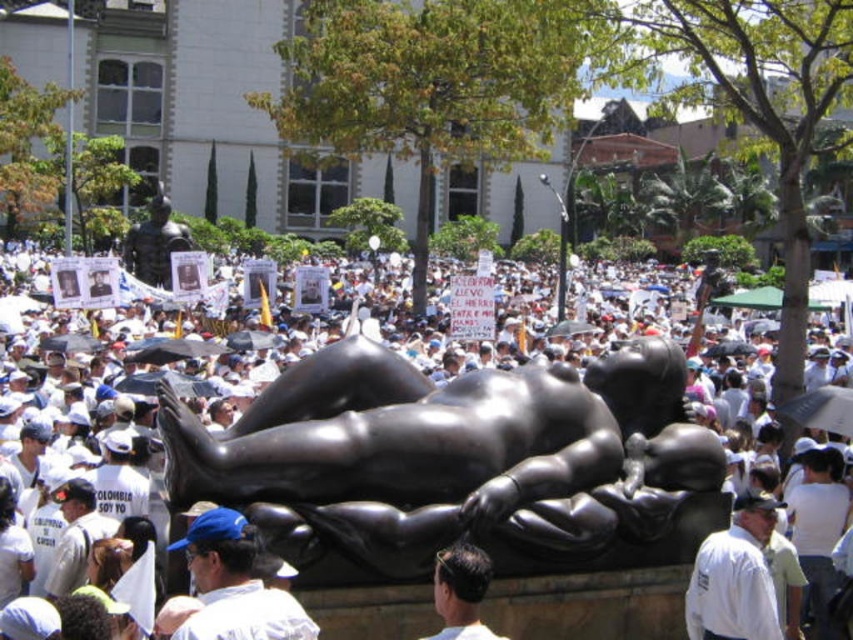
In the scene shown: You are a photographer trying to capture a clear shot of both the black polished statue at center and the dark brown hair at center. Since the statue is wider than the hair, how should you adjust your camera to ensure both are in frame?

The black polished statue at center is wider than the dark brown hair at center, so you should zoom out slightly to accommodate the statue while still capturing the hair in the frame.